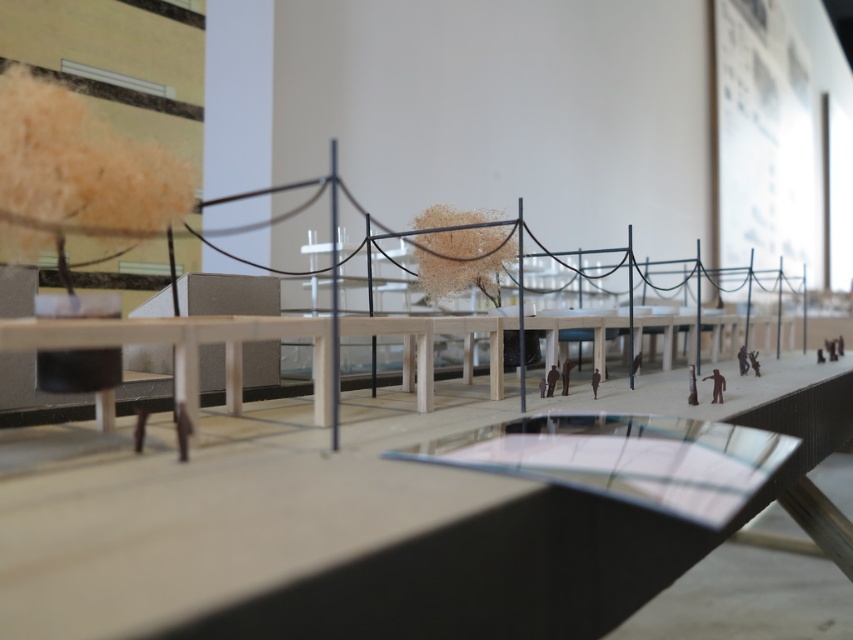
A child wants to place a small toy car between the dark brown wooden figure at center and the nearest tree. The toy car is 1.2 meters long. Will it fit?

The distance between the dark brown wooden figure at center and the nearest tree is 1.16 meters. Since the toy car is 1.2 meters long, it will not fit in the available space.